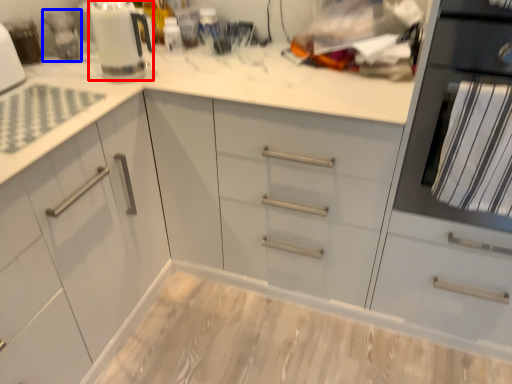
Question: Which object appears closest to the camera in this image, kitchen appliance (highlighted by a red box) or appliance (highlighted by a blue box)?

Choices:
 (A) kitchen appliance
 (B) appliance

Answer: (A)